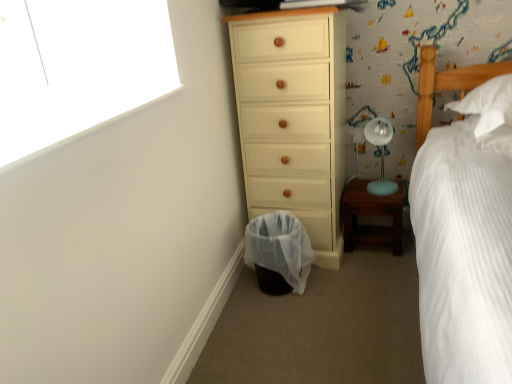
This screenshot has width=512, height=384. In order to click on free space in front of wooden nightstand at lower right in this screenshot , I will do `click(379, 265)`.